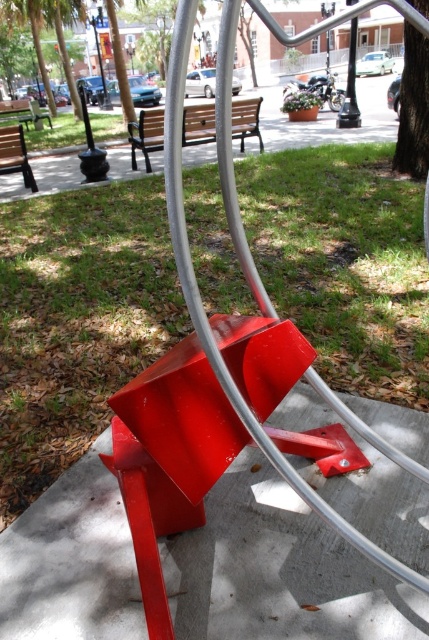
Question: Which of the following is the farthest from the observer?

Choices:
 (A) (14, 150)
 (B) (3, 100)
 (C) (138, 157)

Answer: (B)

Question: Where is metallic pole at upper center located in relation to wooden bench at center in the image?

Choices:
 (A) above
 (B) below

Answer: (A)

Question: Considering the real-world distances, which object is closest to the wooden park bench at left?

Choices:
 (A) wooden bench at center
 (B) wooden bench at upper center
 (C) glossy metal bench at center

Answer: (B)

Question: Which point is farther to the camera?

Choices:
 (A) matte wood bench at upper center
 (B) wooden bench at upper center
 (C) glossy metal bench at center
 (D) wooden bench at center

Answer: (D)

Question: Is matte wood bench at upper center smaller than wooden bench at center?

Choices:
 (A) no
 (B) yes

Answer: (A)

Question: Does wooden park bench at left have a lesser width compared to metallic pole at upper center?

Choices:
 (A) no
 (B) yes

Answer: (B)